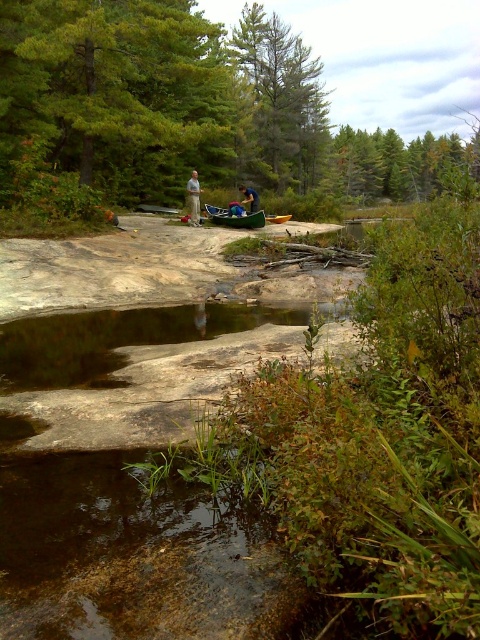
In the scene shown: Who is taller, green leafy tree at upper left or green matte canoe at center?

green leafy tree at upper left

Is point (121, 129) less distant than point (218, 209)?

Yes, point (121, 129) is in front of point (218, 209).

I want to click on green leafy tree at upper left, so coord(112,93).

Based on the photo, does green matte tree at upper center come in front of light brown fabric pants at center?

No, it is not.

Who is positioned more to the right, green matte tree at upper center or light brown fabric pants at center?

green matte tree at upper center

Find the location of a particular element. The width and height of the screenshot is (480, 640). green matte tree at upper center is located at coordinates (283, 97).

Locate an element on the screen. The width and height of the screenshot is (480, 640). green matte tree at upper center is located at coordinates (283, 97).

Which of these two, green matte tree at upper center or green fabric backpack at center, stands taller?

With more height is green matte tree at upper center.

What do you see at coordinates (283, 97) in the screenshot? Image resolution: width=480 pixels, height=640 pixels. I see `green matte tree at upper center` at bounding box center [283, 97].

Where is `green matte tree at upper center`? The height and width of the screenshot is (640, 480). green matte tree at upper center is located at coordinates (283, 97).